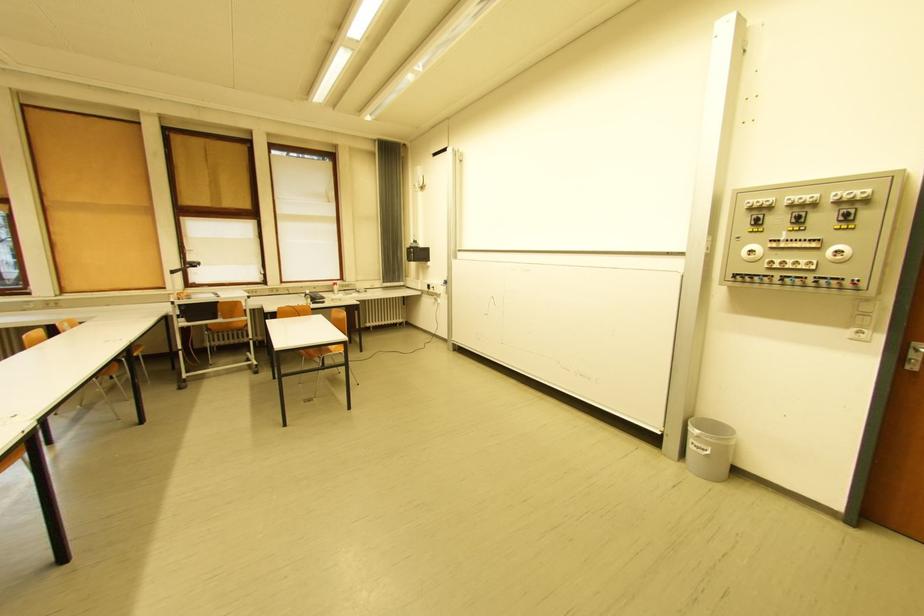
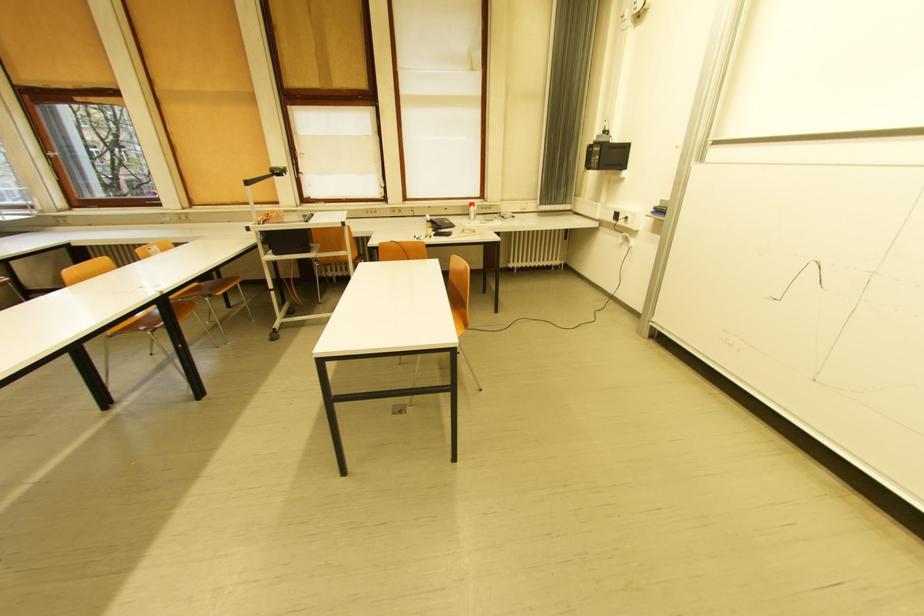
Find the pixel in the second image that matches (x=314, y=293) in the first image.

(434, 219)